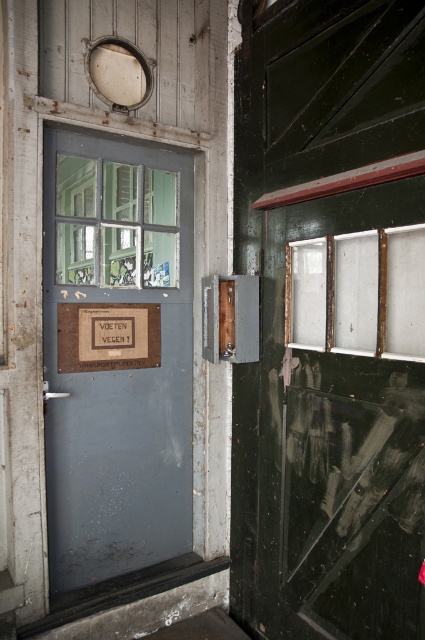
Question: Is rusty metal door at center wider than brown cardboard sign at center?

Choices:
 (A) yes
 (B) no

Answer: (A)

Question: Which point is closer to the camera taking this photo?

Choices:
 (A) (59, 349)
 (B) (104, 355)

Answer: (A)

Question: Considering the relative positions of rusty metal door at center and brown cardboard sign at center in the image provided, where is rusty metal door at center located with respect to brown cardboard sign at center?

Choices:
 (A) left
 (B) right

Answer: (B)

Question: Does rusty metal door at center come in front of brown cardboard sign at center?

Choices:
 (A) yes
 (B) no

Answer: (A)

Question: Among these points, which one is farthest from the camera?

Choices:
 (A) (132, 305)
 (B) (129, 374)

Answer: (A)

Question: Among these points, which one is nearest to the camera?

Choices:
 (A) (78, 509)
 (B) (146, 307)

Answer: (A)